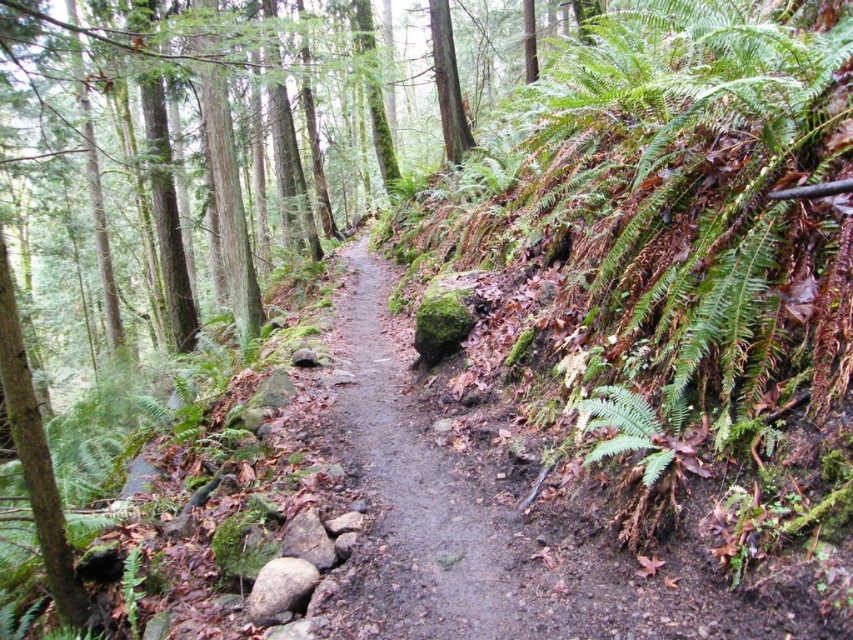
You are a hiker carrying a 40 inch long backpack. You want to walk along the dirt path at center while keeping your backpack parallel to the path. Can you safely pass by the green leafy fern at lower right without hitting the fern with your backpack?

The distance between the dirt path at center and the green leafy fern at lower right is 37.97 inches. Since the backpack is 40 inches long, which is longer than the distance, there is a risk of the backpack hitting the fern when moving parallel to the path. Adjust your position or angle to ensure safe passage.

You are a hiker carrying a heavy backpack and need to choose a path to continue your journey. You see the dirt path at center and the green leafy fern at lower right. Which one is a better option for walking on?

The dirt path at center is larger in size than the green leafy fern at lower right, so it is a better option for walking on since it provides a more stable and spacious path compared to the smaller fern.

You are standing at the edge of the forest trail and want to walk to the point marked as point (412, 497). Based on the description, is this point located on the dirt path or off the path?

The point (412, 497) is on the dirt path at center, so it is located on the path.